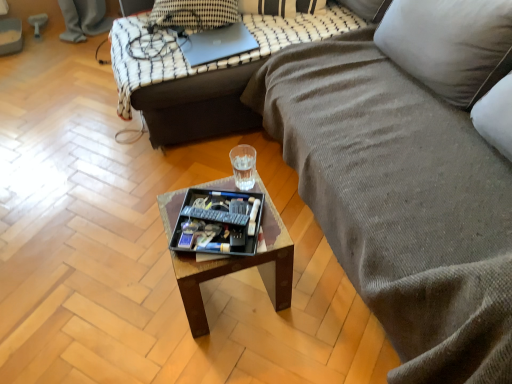
The image size is (512, 384). I want to click on vacant area located to the right-hand side of wooden tray at center, so click(x=317, y=296).